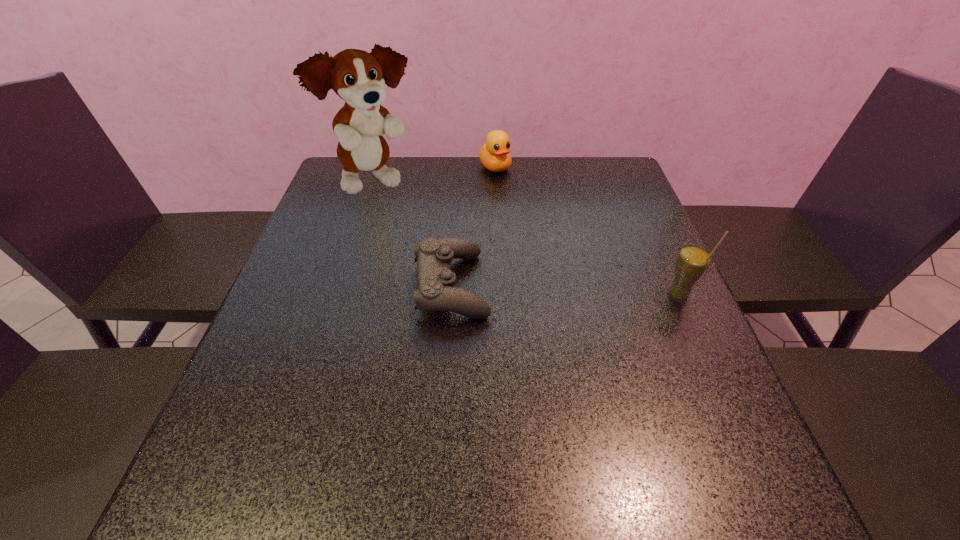
Where is `empty space between the shortest object and the duckling`? empty space between the shortest object and the duckling is located at coordinates (473, 227).

The height and width of the screenshot is (540, 960). I want to click on vacant area between the second shortest object and the rightmost object, so click(587, 231).

Find the location of `vacant point located between the rightmost object and the second shortest object`. vacant point located between the rightmost object and the second shortest object is located at coordinates (587, 231).

Image resolution: width=960 pixels, height=540 pixels. I want to click on blank region between the leftmost object and the shortest object, so click(x=414, y=234).

Identify the location of vacant point located between the leftmost object and the rightmost object. This screenshot has height=540, width=960. (528, 239).

You are a GUI agent. You are given a task and a screenshot of the screen. Output one action in this format:
    pyautogui.click(x=<x>, y=<y>)
    Task: Click on the free space between the puppy and the duckling
    
    Given the screenshot: What is the action you would take?
    pyautogui.click(x=436, y=175)

Identify which object is the nearest to the shortest object. Please provide its 2D coordinates. Your answer should be formatted as a tuple, i.e. [(x, y)], where the tuple contains the x and y coordinates of a point satisfying the conditions above.

[(358, 77)]

Identify the location of object that is the third closest to the tallest object. The width and height of the screenshot is (960, 540). (693, 260).

I want to click on free region that satisfies the following two spatial constraints: 1. on the front side of the straw for drinking; 2. on the left side of the control, so click(x=450, y=295).

Locate an element on the screen. This screenshot has height=540, width=960. free space in the image that satisfies the following two spatial constraints: 1. on the front side of the third tallest object; 2. on the right side of the straw for drinking is located at coordinates (501, 295).